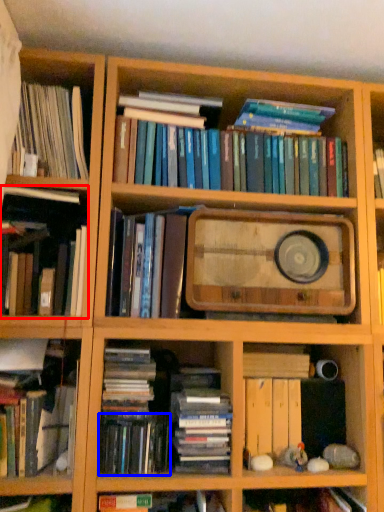
Question: Which object is closer to the camera taking this photo, book (highlighted by a red box) or book (highlighted by a blue box)?

Choices:
 (A) book
 (B) book

Answer: (A)